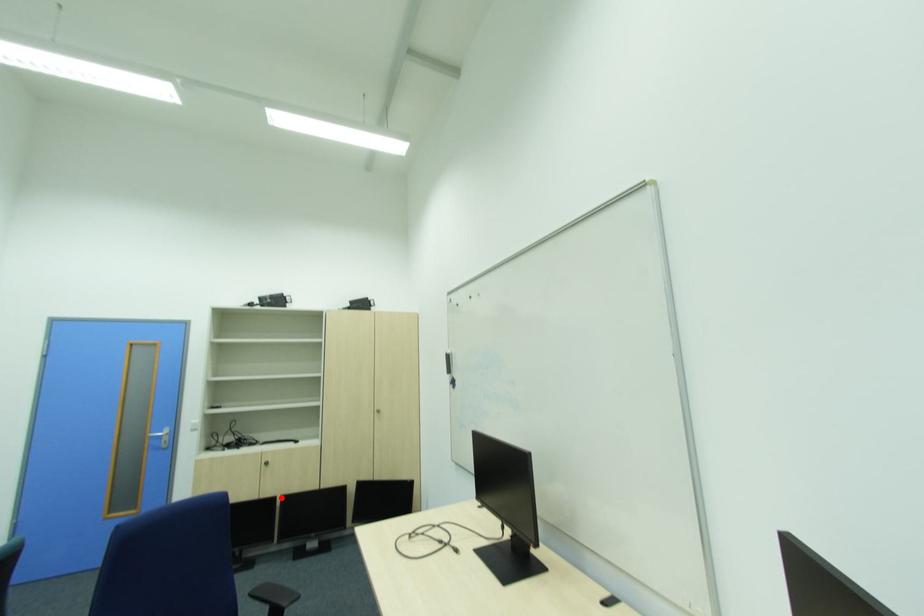
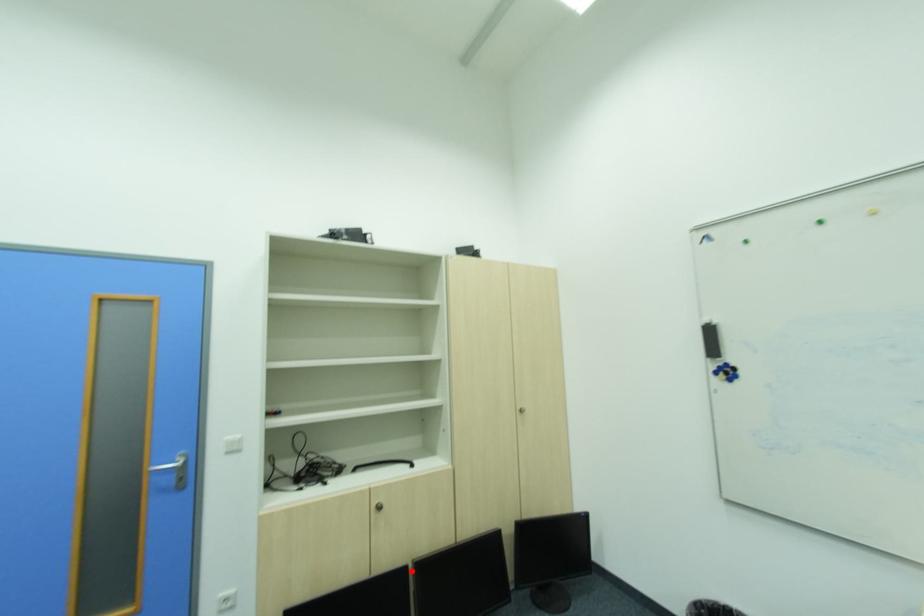
I am providing you with two images of the same scene from different viewpoints. A red point is marked on the first image and another point is marked on the second image. Are the points marked in image1 and image2 representing the same 3D position?

Yes